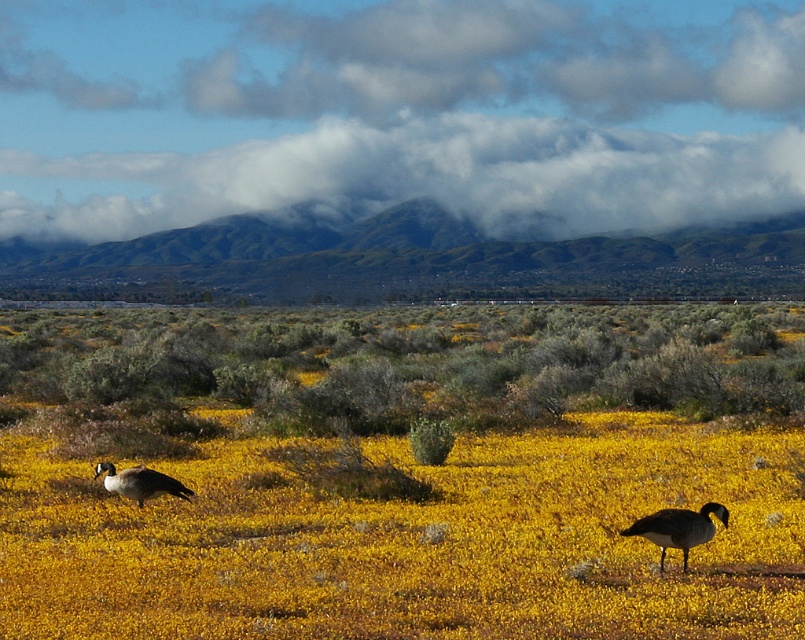
Who is more forward, (43, 593) or (678, 531)?

Point (43, 593) is more forward.

Is yellow matte flower at lower left positioned in front of dark gray matte goose at lower right?

Yes.

Who is more distant from viewer, (190,580) or (647,524)?

The point (647,524) is more distant.

In order to click on yellow matte flower at lower left in this screenshot , I will do `click(415, 540)`.

Is yellow matte flower at lower left to the right of dark gray goose at lower left from the viewer's perspective?

Indeed, yellow matte flower at lower left is positioned on the right side of dark gray goose at lower left.

Is yellow matte flower at lower left above dark gray goose at lower left?

Actually, yellow matte flower at lower left is below dark gray goose at lower left.

Is point (109, 528) positioned before point (135, 497)?

That is True.

The width and height of the screenshot is (805, 640). I want to click on yellow matte flower at lower left, so click(415, 540).

Measure the distance between point (x=721, y=520) and camera.

Point (x=721, y=520) and camera are 10.56 meters apart from each other.

Find the location of a particular element. dark gray matte goose at lower right is located at coordinates (678, 529).

This screenshot has height=640, width=805. What do you see at coordinates (678, 529) in the screenshot?
I see `dark gray matte goose at lower right` at bounding box center [678, 529].

Identify the location of dark gray matte goose at lower right. (678, 529).